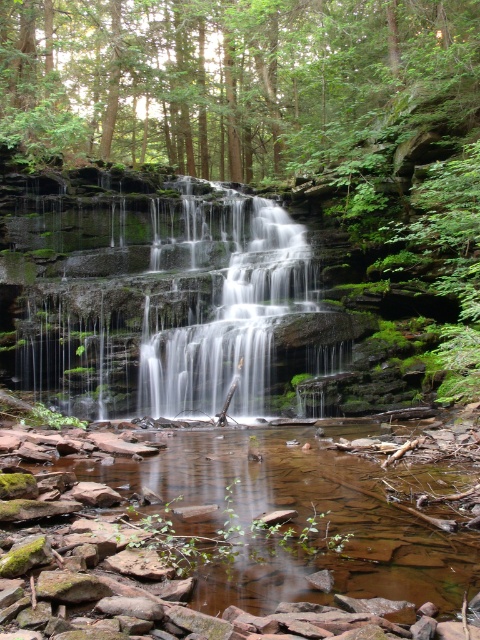
Does brown rock stream at lower center appear under smooth gray rock waterfall at center?

Yes, brown rock stream at lower center is below smooth gray rock waterfall at center.

Can you confirm if brown rock stream at lower center is positioned to the left of smooth gray rock waterfall at center?

No, brown rock stream at lower center is not to the left of smooth gray rock waterfall at center.

Is point (252, 554) positioned after point (63, 282)?

No, it is in front of (63, 282).

This screenshot has height=640, width=480. Find the location of `brown rock stream at lower center`. brown rock stream at lower center is located at coordinates (239, 538).

Is green leafy tree at upper center below smooth gray rock waterfall at center?

Actually, green leafy tree at upper center is above smooth gray rock waterfall at center.

Where is `green leafy tree at upper center`? Image resolution: width=480 pixels, height=640 pixels. green leafy tree at upper center is located at coordinates (228, 77).

Which is above, brown rock stream at lower center or green leafy tree at upper center?

green leafy tree at upper center is higher up.

Which is in front, point (87, 509) or point (71, 147)?

Point (87, 509)

At what (x,y) coordinates should I click in order to perform the action: click on brown rock stream at lower center. Please return your answer as a coordinate pair (x, y). Looking at the image, I should click on (239, 538).